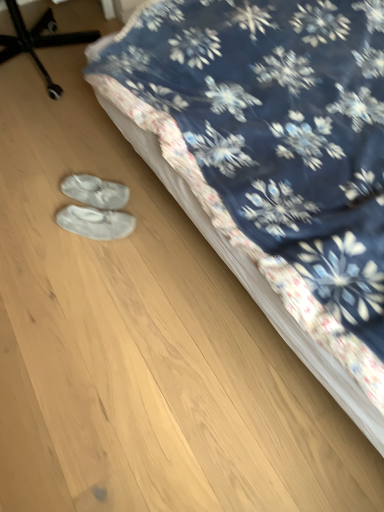
Question: Considering the relative positions of white suede slippers at lower center, the first footwear from the bottom, and floral fabric bed at center in the image provided, is white suede slippers at lower center, the first footwear from the bottom, to the right of floral fabric bed at center from the viewer's perspective?

Choices:
 (A) yes
 (B) no

Answer: (B)

Question: From the image's perspective, is white suede slippers at lower center, the first footwear from the bottom, beneath floral fabric bed at center?

Choices:
 (A) no
 (B) yes

Answer: (B)

Question: From a real-world perspective, does white suede slippers at lower center, which is the second footwear from top to bottom, stand above floral fabric bed at center?

Choices:
 (A) no
 (B) yes

Answer: (A)

Question: Can you confirm if white suede slippers at lower center, the first footwear from the bottom, is shorter than floral fabric bed at center?

Choices:
 (A) yes
 (B) no

Answer: (A)

Question: Is white suede slippers at lower center, the first footwear from the bottom, with floral fabric bed at center?

Choices:
 (A) no
 (B) yes

Answer: (A)

Question: Does white suede slippers at lower center, the first footwear from the bottom, lie behind floral fabric bed at center?

Choices:
 (A) yes
 (B) no

Answer: (A)

Question: Does white suede slippers at lower center, which is the second footwear from top to bottom, have a larger size compared to white fabric shoe covers at lower left, which ranks as the first footwear in top-to-bottom order?

Choices:
 (A) no
 (B) yes

Answer: (A)

Question: Considering the relative sizes of white suede slippers at lower center, which is the second footwear from top to bottom, and white fabric shoe covers at lower left, arranged as the second footwear when ordered from the bottom, in the image provided, is white suede slippers at lower center, which is the second footwear from top to bottom, shorter than white fabric shoe covers at lower left, arranged as the second footwear when ordered from the bottom,?

Choices:
 (A) yes
 (B) no

Answer: (A)

Question: From the image's perspective, is white suede slippers at lower center, which is the second footwear from top to bottom, below white fabric shoe covers at lower left, which ranks as the first footwear in top-to-bottom order?

Choices:
 (A) no
 (B) yes

Answer: (B)

Question: Is the depth of white suede slippers at lower center, which is the second footwear from top to bottom, greater than that of white fabric shoe covers at lower left, arranged as the second footwear when ordered from the bottom?

Choices:
 (A) yes
 (B) no

Answer: (B)

Question: Can you confirm if white suede slippers at lower center, which is the second footwear from top to bottom, is positioned to the left of white fabric shoe covers at lower left, which ranks as the first footwear in top-to-bottom order?

Choices:
 (A) no
 (B) yes

Answer: (A)

Question: From a real-world perspective, is white suede slippers at lower center, which is the second footwear from top to bottom, located beneath white fabric shoe covers at lower left, arranged as the second footwear when ordered from the bottom?

Choices:
 (A) yes
 (B) no

Answer: (B)

Question: Is white fabric shoe covers at lower left, arranged as the second footwear when ordered from the bottom, wider than white suede slippers at lower center, which is the second footwear from top to bottom?

Choices:
 (A) no
 (B) yes

Answer: (A)